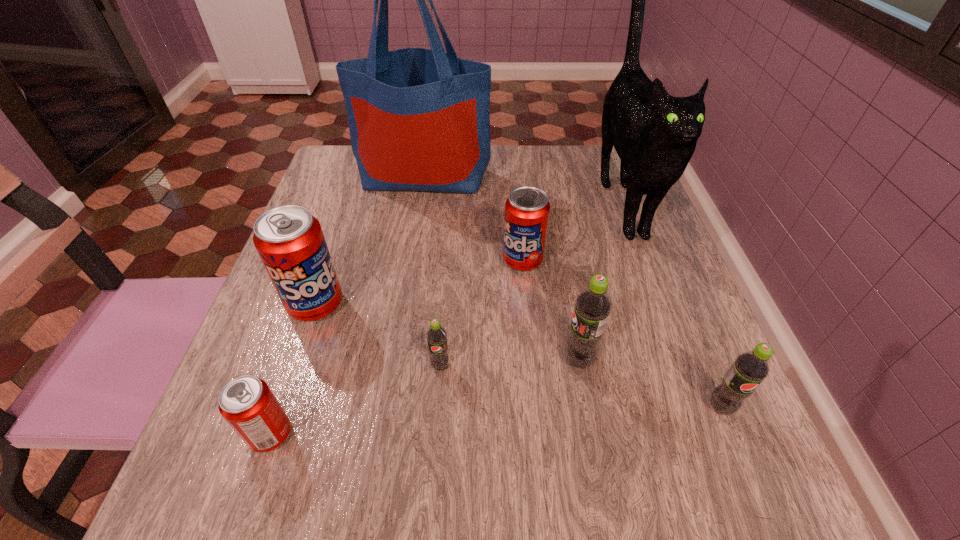
The image size is (960, 540). Find the location of `soda can object that ranks as the fourth closest to the red handbag`. soda can object that ranks as the fourth closest to the red handbag is located at coordinates 436,335.

This screenshot has width=960, height=540. I want to click on soda can object that ranks as the second closest to the biggest green soda, so click(x=527, y=209).

Identify which red soda can is the closest to the second nearest red soda can. Please provide its 2D coordinates. Your answer should be formatted as a tuple, i.e. [(x, y)], where the tuple contains the x and y coordinates of a point satisfying the conditions above.

[(247, 403)]

Identify which red soda can is the nearest to the rightmost soda can. Please provide its 2D coordinates. Your answer should be formatted as a tuple, i.e. [(x, y)], where the tuple contains the x and y coordinates of a point satisfying the conditions above.

[(527, 209)]

Locate an element on the screen. Image resolution: width=960 pixels, height=540 pixels. green soda that is the third closest to the nearest red soda can is located at coordinates (750, 368).

You are a GUI agent. You are given a task and a screenshot of the screen. Output one action in this format:
    pyautogui.click(x=<x>, y=<y>)
    Task: Click on the green soda identified as the second closest to the fourth farthest object
    This screenshot has height=540, width=960.
    Given the screenshot: What is the action you would take?
    pyautogui.click(x=593, y=305)

This screenshot has width=960, height=540. I want to click on vacant space that satisfies the following two spatial constraints: 1. on the back side of the red handbag; 2. on the left side of the smallest red soda can, so 358,176.

What are the coordinates of `free spot that satisfies the following two spatial constraints: 1. on the front label of the sixth object from left to right; 2. on the front label of the smallest green soda` in the screenshot? It's located at (580, 366).